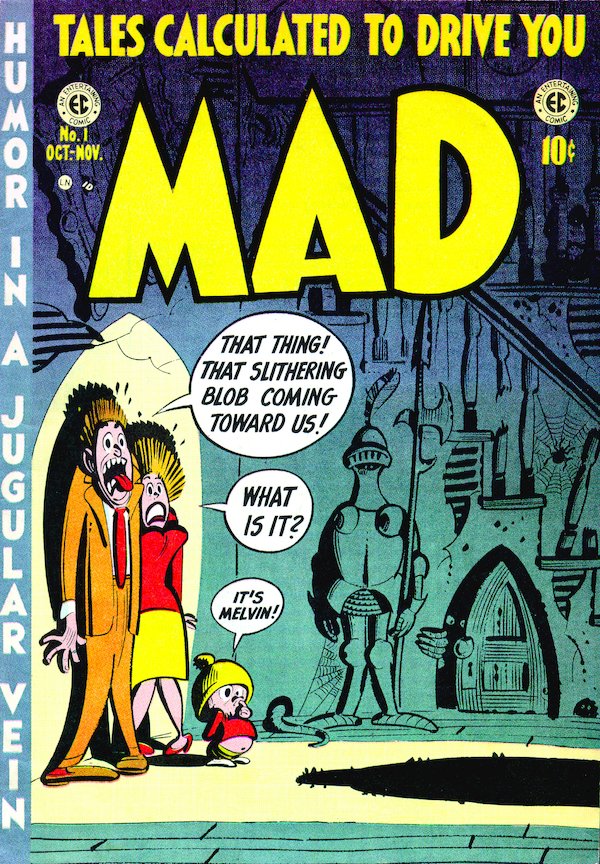
Where is `door`? This screenshot has height=864, width=600. door is located at coordinates (499, 656).